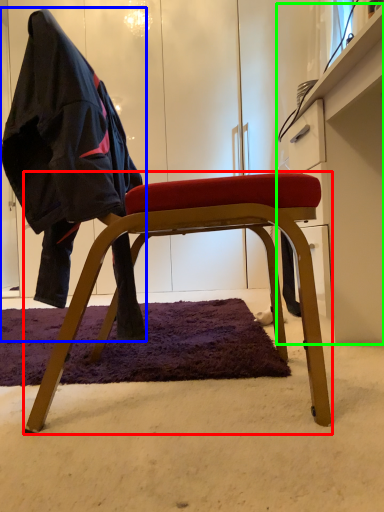
Question: Considering the real-world distances, which object is farthest from chair (highlighted by a red box)? person (highlighted by a blue box) or dresser (highlighted by a green box)?

Choices:
 (A) person
 (B) dresser

Answer: (B)